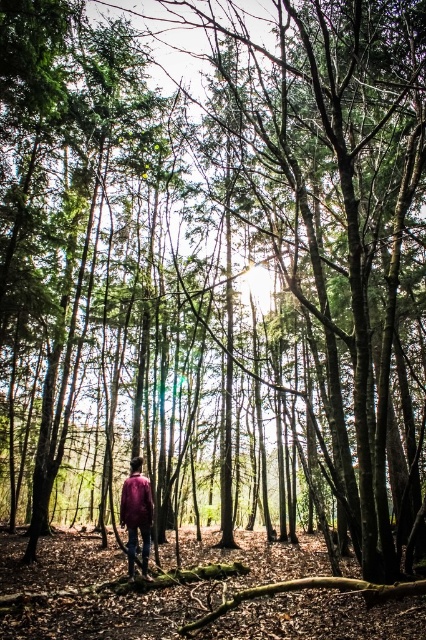
You are a photographer trying to capture the forest scene. You notice the matte purple shirt at center and the matte purple jacket at center. Which one appears wider in the photo?

The matte purple shirt at center appears wider than the matte purple jacket at center because its width surpasses the jacket.

You are a photographer trying to capture the person in the forest scene. You notice the matte purple shirt at center and the matte purple jacket at center. Which one should you focus on to ensure the subject is sharp and in focus?

The matte purple shirt at center is in front of the matte purple jacket at center, so focusing on the matte purple shirt at center will ensure the subject is sharp and in focus.